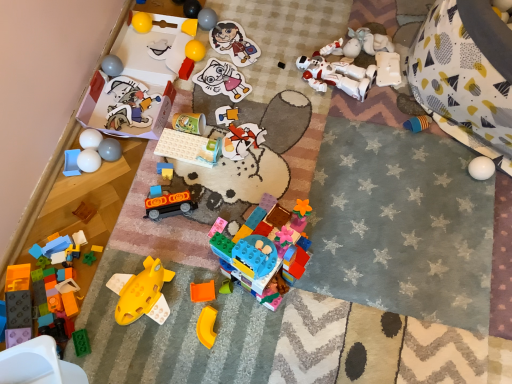
Image resolution: width=512 pixels, height=384 pixels. Identify the location of free space between yellow matte block at center, which appears as the 13th toy when viewed from the right, and white matte robot at center, marked as the third toy in a right-to-left arrangement. (254, 53).